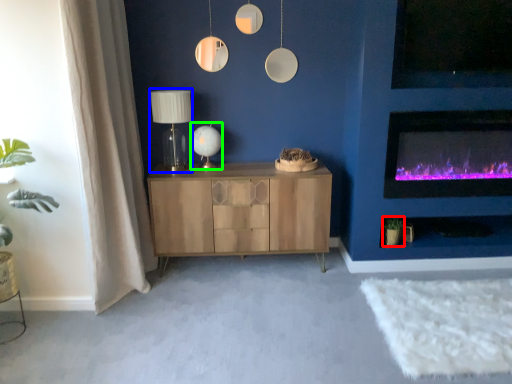
Question: Based on their relative distances, which object is farther from plant (highlighted by a red box)? Choose from table lamp (highlighted by a blue box) and table lamp (highlighted by a green box).

Choices:
 (A) table lamp
 (B) table lamp

Answer: (A)